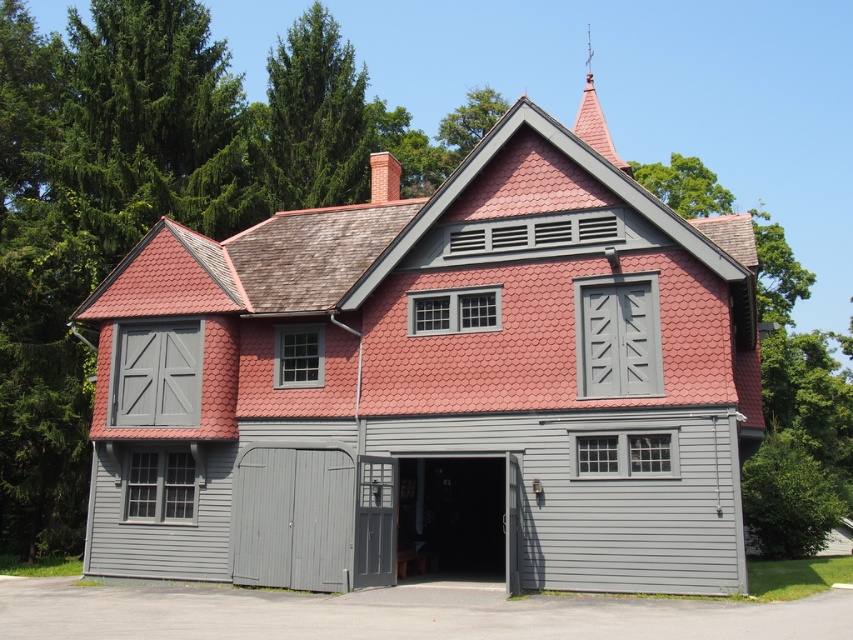
Who is shorter, matte gray shed at center or gray wood/grey siding garage door at lower left?

Standing shorter between the two is gray wood/grey siding garage door at lower left.

The image size is (853, 640). Describe the element at coordinates (445, 372) in the screenshot. I see `matte gray shed at center` at that location.

What are the coordinates of `matte gray shed at center` in the screenshot? It's located at (445, 372).